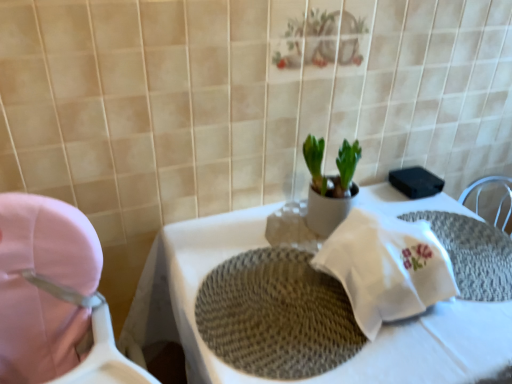
Identify the location of blank space situated above white woven placemat at center (from a real-world perspective). (335, 282).